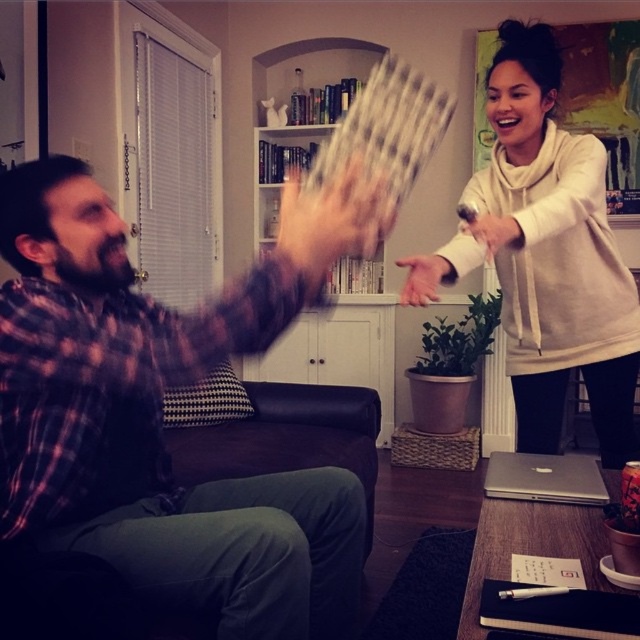
You are a fashion designer observing the scene. You need to decide which clothing item is more to the left between the plaid fabric shirt at left and the white soft hoodie at upper right. Which one is it?

The plaid fabric shirt at left is more to the left than the white soft hoodie at upper right.

You are standing at the point labeled point [506,236] and want to move to the point labeled point [522,100]. Is the point you want to reach behind you or in front of you?

The point labeled point [522,100] is behind point [506,236], so the point you want to reach is behind you.

In the scene shown: You are a photographer trying to capture a candid shot of the plaid fabric shirt at left and the matte white hand at center. Based on their positions, which object should you focus on first to ensure both are in frame without moving the camera?

The plaid fabric shirt at left is much taller than the matte white hand at center, so focus on the plaid fabric shirt at left first to ensure the matte white hand at center is within the frame.